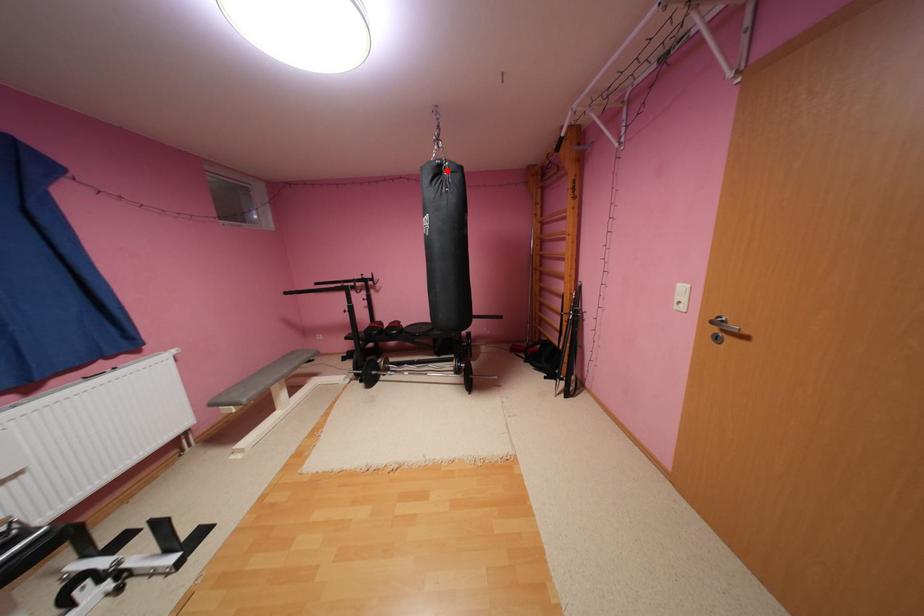
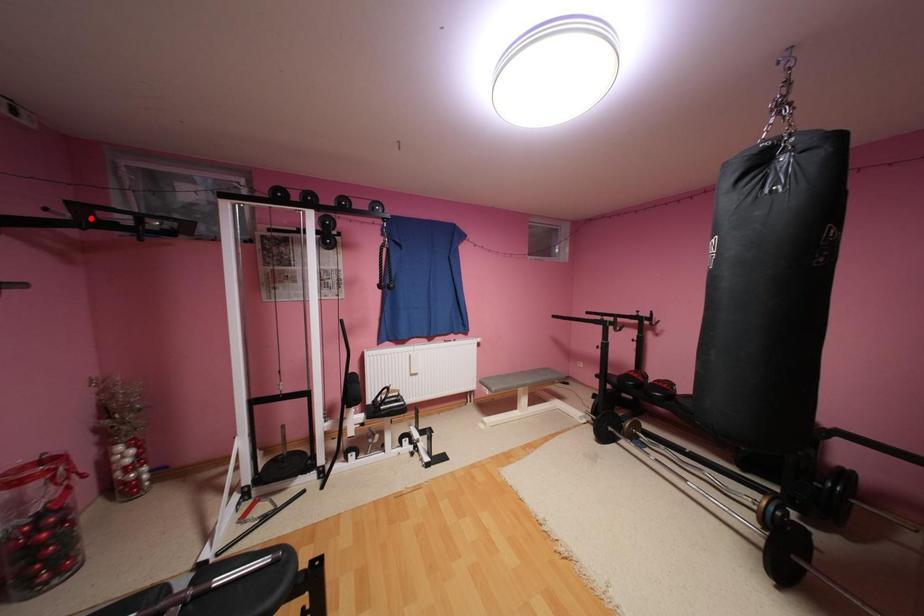
I am providing you with two images of the same scene from different viewpoints. A red point is marked on the first image and another point is marked on the second image. Does the point marked in image1 correspond to the same location as the one in image2?

No